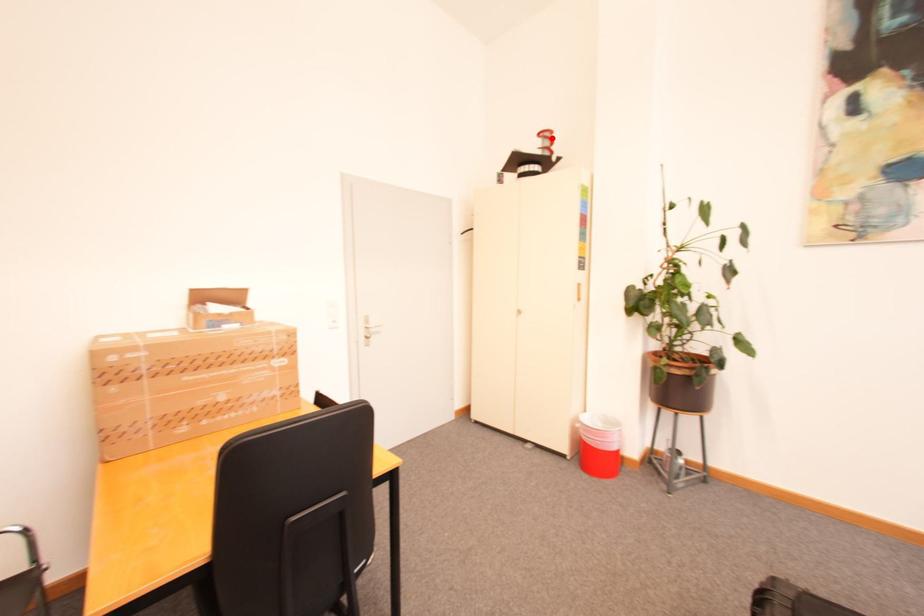
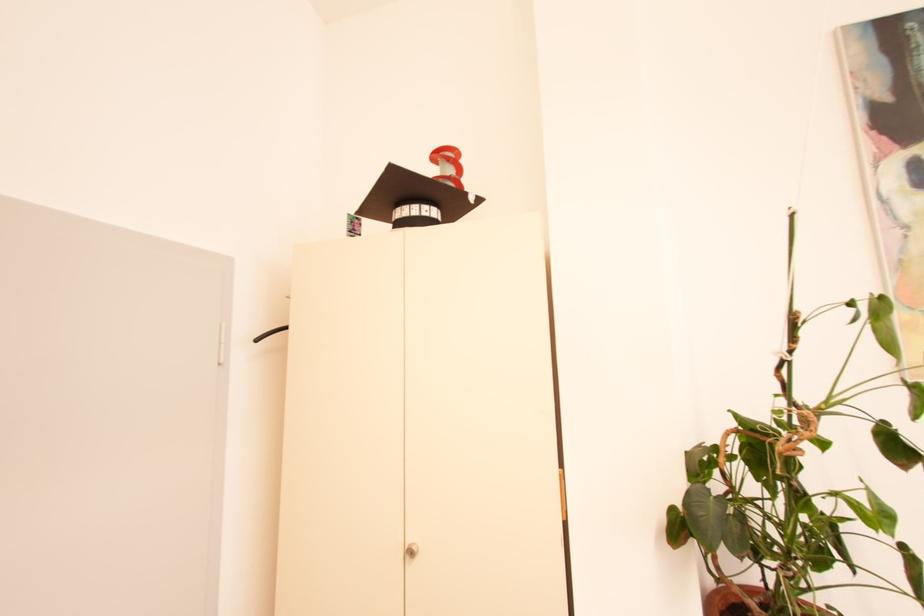
Find the pixel in the second image that matches the highlighted location in the first image.

(455, 160)